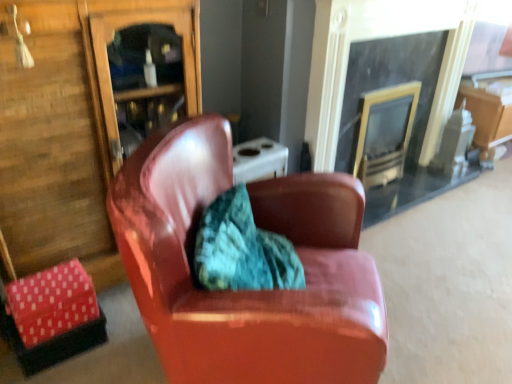
The width and height of the screenshot is (512, 384). What are the coordinates of `black glass fireplace at upper right` in the screenshot? It's located at (376, 38).

Describe the element at coordinates (376, 38) in the screenshot. I see `black glass fireplace at upper right` at that location.

From the picture: What is the approximate width of black glass fireplace at upper right?

It is 27.45 centimeters.

Describe the element at coordinates (250, 291) in the screenshot. I see `shiny leather armchair at center` at that location.

The height and width of the screenshot is (384, 512). In order to click on shiny leather armchair at center in this screenshot , I will do `click(250, 291)`.

Image resolution: width=512 pixels, height=384 pixels. I want to click on black glass fireplace at upper right, so click(376, 38).

From the picture: Considering the relative positions of shiny leather armchair at center and black glass fireplace at upper right in the image provided, is shiny leather armchair at center to the right of black glass fireplace at upper right from the viewer's perspective?

Incorrect, shiny leather armchair at center is not on the right side of black glass fireplace at upper right.

Considering the positions of objects shiny leather armchair at center and black glass fireplace at upper right in the image provided, who is in front, shiny leather armchair at center or black glass fireplace at upper right?

shiny leather armchair at center is in front.

Which is closer, (170, 364) or (443, 112)?

Point (170, 364) is closer to the camera than point (443, 112).

From the image's perspective, is shiny leather armchair at center positioned above or below black glass fireplace at upper right?

shiny leather armchair at center is below black glass fireplace at upper right.

From a real-world perspective, is shiny leather armchair at center physically located above or below black glass fireplace at upper right?

From a real-world perspective, shiny leather armchair at center is physically below black glass fireplace at upper right.

Is shiny leather armchair at center thinner than black glass fireplace at upper right?

In fact, shiny leather armchair at center might be wider than black glass fireplace at upper right.

Consider the image. Considering the relative sizes of shiny leather armchair at center and black glass fireplace at upper right in the image provided, is shiny leather armchair at center shorter than black glass fireplace at upper right?

Yes, shiny leather armchair at center is shorter than black glass fireplace at upper right.

Can you confirm if shiny leather armchair at center is smaller than black glass fireplace at upper right?

Incorrect, shiny leather armchair at center is not smaller in size than black glass fireplace at upper right.

Is shiny leather armchair at center situated inside black glass fireplace at upper right or outside?

shiny leather armchair at center lies outside black glass fireplace at upper right.

Is shiny leather armchair at center directly adjacent to black glass fireplace at upper right?

No.

Consider the image. Is shiny leather armchair at center facing towards black glass fireplace at upper right?

No, shiny leather armchair at center is not turned towards black glass fireplace at upper right.

What's the angular difference between shiny leather armchair at center and black glass fireplace at upper right's facing directions?

They differ by 47 degrees in their facing directions.

Measure the distance between shiny leather armchair at center and black glass fireplace at upper right.

shiny leather armchair at center is 1.14 meters from black glass fireplace at upper right.

Image resolution: width=512 pixels, height=384 pixels. Find the location of `chair that is in front of the black glass fireplace at upper right`. chair that is in front of the black glass fireplace at upper right is located at coordinates click(x=250, y=291).

Based on the photo, would you say black glass fireplace at upper right is to the left or to the right of shiny leather armchair at center in the picture?

Clearly, black glass fireplace at upper right is on the right of shiny leather armchair at center in the image.

Considering their positions, is black glass fireplace at upper right located in front of or behind shiny leather armchair at center?

Clearly, black glass fireplace at upper right is behind shiny leather armchair at center.

Is point (348, 38) positioned behind point (165, 372)?

Yes.

From the image's perspective, between black glass fireplace at upper right and shiny leather armchair at center, which one is located above?

black glass fireplace at upper right, from the image's perspective.

From a real-world perspective, is black glass fireplace at upper right over shiny leather armchair at center?

Yes, from a real-world perspective, black glass fireplace at upper right is on top of shiny leather armchair at center.

Considering the relative sizes of black glass fireplace at upper right and shiny leather armchair at center in the image provided, is black glass fireplace at upper right thinner than shiny leather armchair at center?

Correct, the width of black glass fireplace at upper right is less than that of shiny leather armchair at center.

Considering the sizes of objects black glass fireplace at upper right and shiny leather armchair at center in the image provided, who is shorter, black glass fireplace at upper right or shiny leather armchair at center?

shiny leather armchair at center.

Does black glass fireplace at upper right have a larger size compared to shiny leather armchair at center?

No.

Consider the image. Would you say black glass fireplace at upper right contains shiny leather armchair at center?

No, shiny leather armchair at center is not a part of black glass fireplace at upper right.

Is there a large distance between black glass fireplace at upper right and shiny leather armchair at center?

Yes.

Is black glass fireplace at upper right positioned with its back to shiny leather armchair at center?

That's not correct — black glass fireplace at upper right is not looking away from shiny leather armchair at center.

Can you tell me how much black glass fireplace at upper right and shiny leather armchair at center differ in facing direction?

Result: There is a 47-degree angle between the facing directions of black glass fireplace at upper right and shiny leather armchair at center.

How distant is black glass fireplace at upper right from shiny leather armchair at center?

A distance of 3.75 feet exists between black glass fireplace at upper right and shiny leather armchair at center.

This screenshot has width=512, height=384. In order to click on fireplace lying behind the shiny leather armchair at center in this screenshot , I will do `click(376, 38)`.

Where is `chair directly beneath the black glass fireplace at upper right (from a real-world perspective)`? chair directly beneath the black glass fireplace at upper right (from a real-world perspective) is located at coordinates (250, 291).

Locate an element on the screen. This screenshot has height=384, width=512. chair that is on the left side of black glass fireplace at upper right is located at coordinates (250, 291).